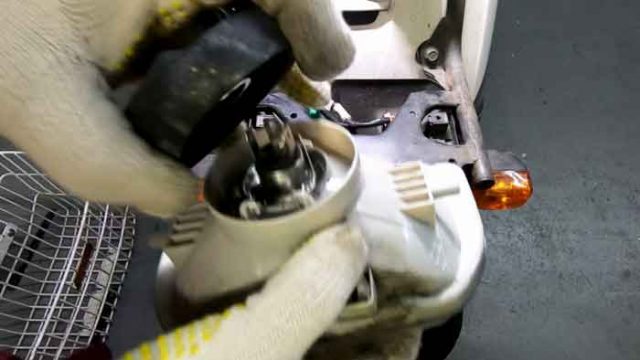
Find the location of a particular element. black cable is located at coordinates (368, 121).